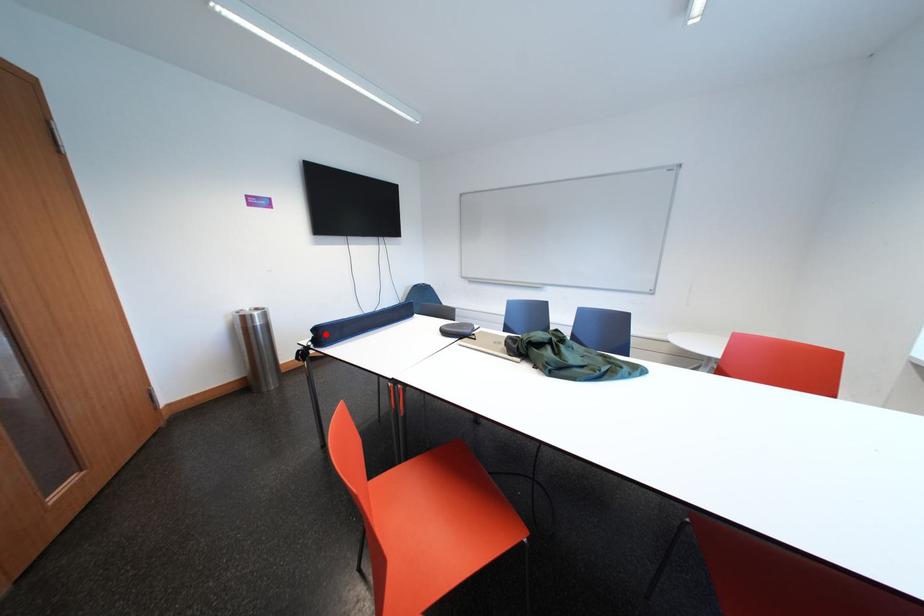
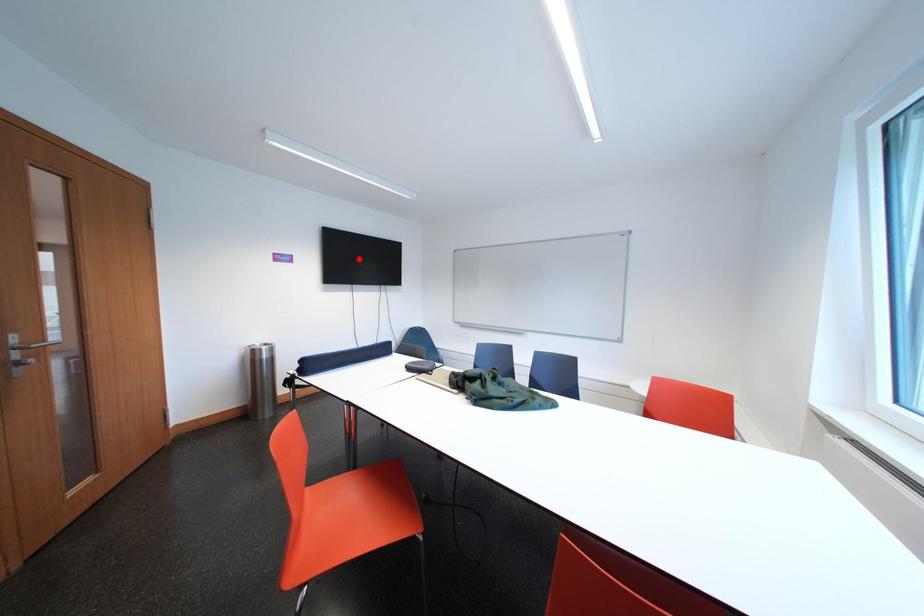
I am providing you with two images of the same scene from different viewpoints. A red point is marked on the first image and another point is marked on the second image. Is the red point in image1 aligned with the point shown in image2?

No